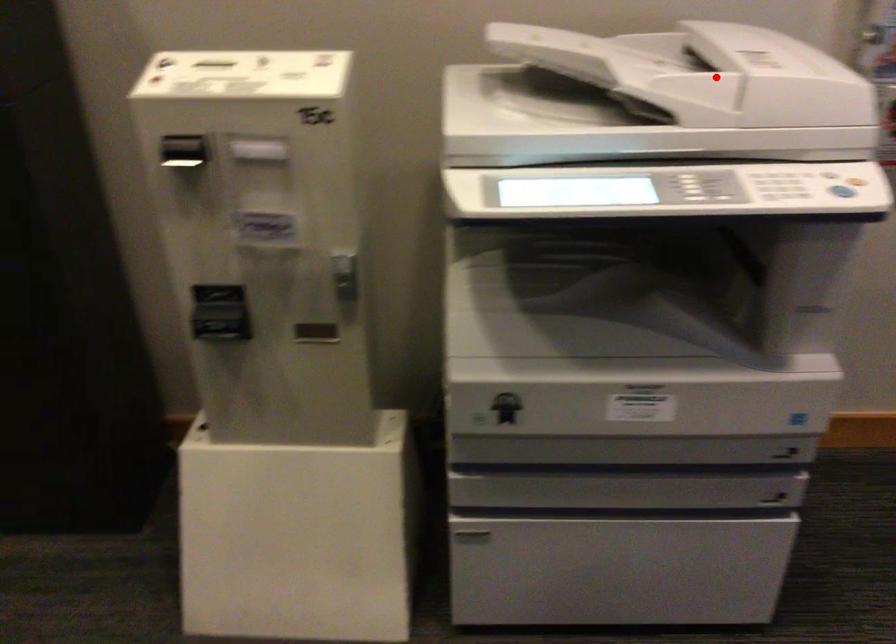
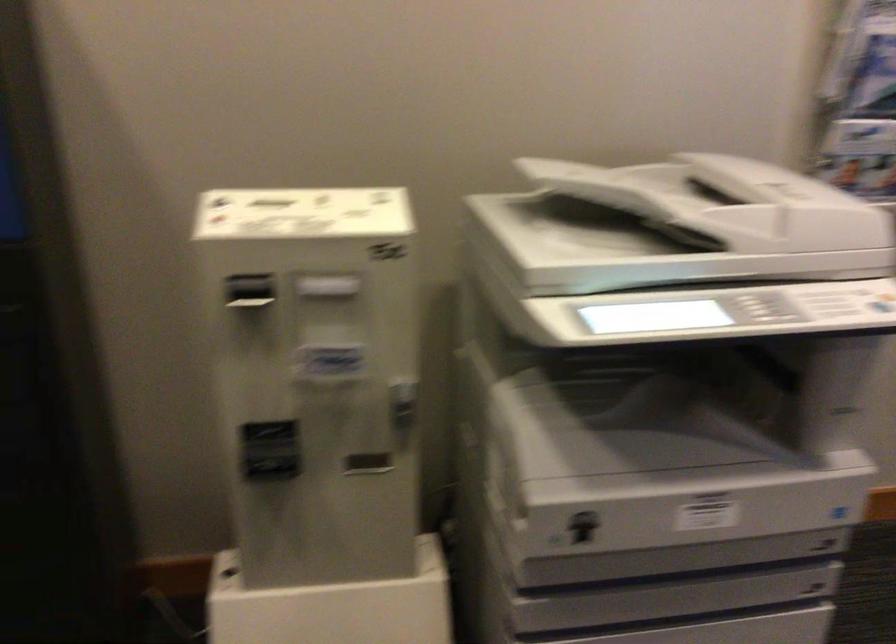
Question: I am providing you with two images of the same scene from different viewpoints. Image1 has a red point marked. In image2, the corresponding 3D location appears at what relative position? Reply with the corresponding letter.

Choices:
 (A) Closer
 (B) Farther

Answer: (B)